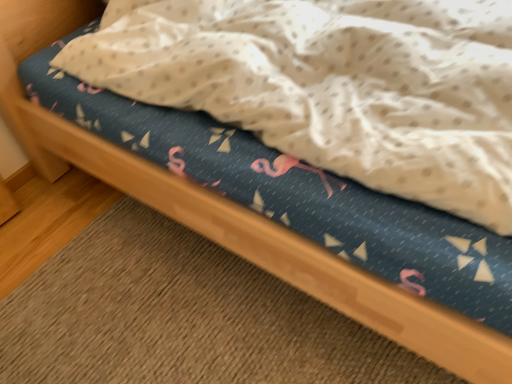
The width and height of the screenshot is (512, 384). What are the coordinates of `blue fabric bed at lower center` in the screenshot? It's located at (181, 317).

What do you see at coordinates (181, 317) in the screenshot?
I see `blue fabric bed at lower center` at bounding box center [181, 317].

Measure the distance between point (219, 254) and camera.

The depth of point (219, 254) is 4.67 feet.

This screenshot has width=512, height=384. What are the coordinates of `blue fabric bed at lower center` in the screenshot? It's located at (181, 317).